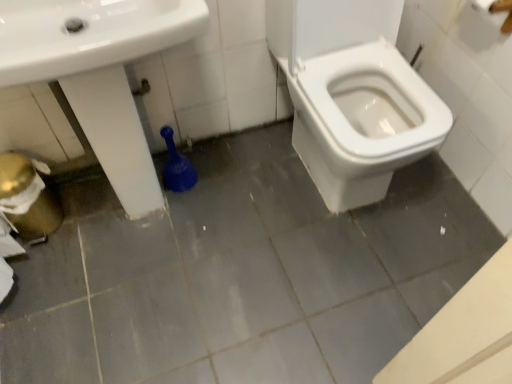
Image resolution: width=512 pixels, height=384 pixels. Find the location of `free space in front of white glossy sink at lower left`. free space in front of white glossy sink at lower left is located at coordinates point(125,317).